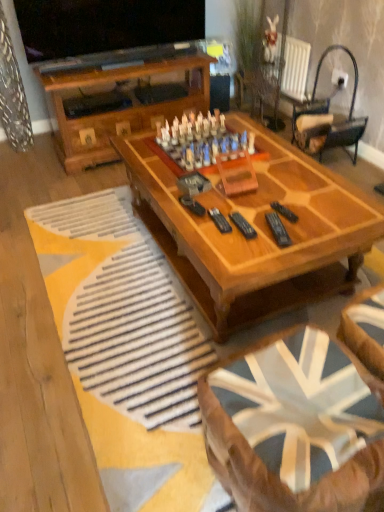
This screenshot has width=384, height=512. In order to click on free space between black plastic remote at center, positioned as the first remote in right-to-left order, and wooden chess set at center in this screenshot , I will do `click(253, 186)`.